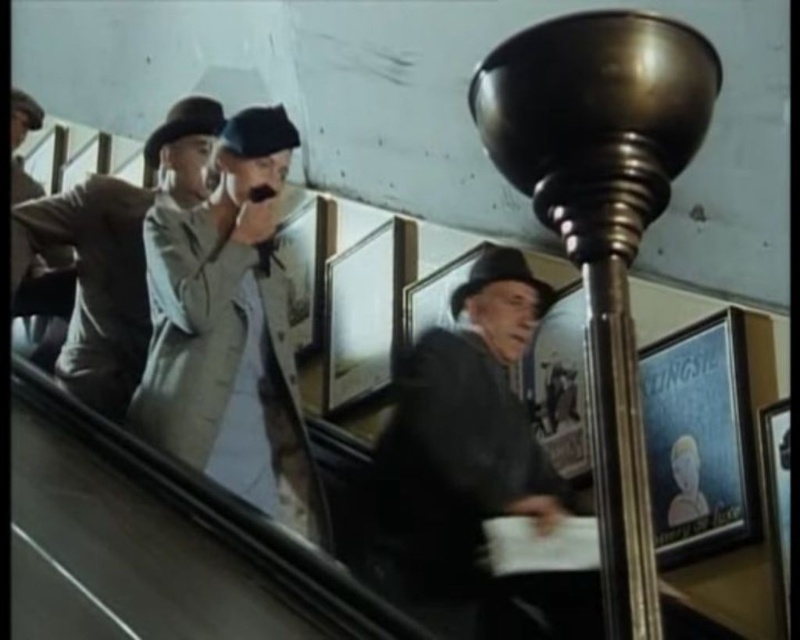
Can you confirm if dark gray wool coat at center is positioned to the left of light beige coat at left?

No, dark gray wool coat at center is not to the left of light beige coat at left.

Does dark gray wool coat at center have a larger size compared to light beige coat at left?

Indeed, dark gray wool coat at center has a larger size compared to light beige coat at left.

Is point (552, 481) positioned after point (180, 161)?

No, (552, 481) is closer to viewer.

At what (x,y) coordinates should I click in order to perform the action: click on dark gray wool coat at center. Please return your answer as a coordinate pair (x, y). This screenshot has width=800, height=640. Looking at the image, I should click on (462, 456).

Describe the element at coordinates (229, 332) in the screenshot. I see `light beige suit at center` at that location.

Does light beige suit at center appear over light beige coat at left?

No.

Is point (272, 282) farther from camera compared to point (102, 285)?

No, it is not.

Locate an element on the screen. The height and width of the screenshot is (640, 800). light beige suit at center is located at coordinates (229, 332).

Can you confirm if light beige suit at center is taller than dark gray wool coat at center?

Yes, light beige suit at center is taller than dark gray wool coat at center.

Is light beige suit at center to the right of dark gray wool coat at center from the viewer's perspective?

In fact, light beige suit at center is to the left of dark gray wool coat at center.

Describe the element at coordinates (229, 332) in the screenshot. The width and height of the screenshot is (800, 640). I see `light beige suit at center` at that location.

Where is `light beige suit at center`? The image size is (800, 640). light beige suit at center is located at coordinates (229, 332).